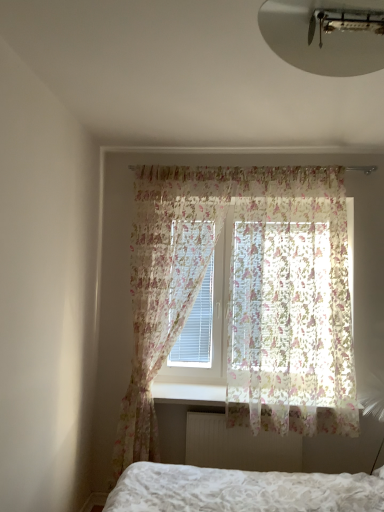
Question: Are translucent floral fabric at center, positioned as the first curtain in left-to-right order, and white matte ceiling light at upper center beside each other?

Choices:
 (A) no
 (B) yes

Answer: (A)

Question: From a real-world perspective, is translucent floral fabric at center, positioned as the first curtain in left-to-right order, below white matte ceiling light at upper center?

Choices:
 (A) yes
 (B) no

Answer: (A)

Question: From a real-world perspective, is translucent floral fabric at center, positioned as the first curtain in left-to-right order, positioned over white matte ceiling light at upper center based on gravity?

Choices:
 (A) yes
 (B) no

Answer: (B)

Question: Would you say translucent floral fabric at center, the 2th curtain in the right-to-left sequence, contains white matte ceiling light at upper center?

Choices:
 (A) yes
 (B) no

Answer: (B)

Question: Is translucent floral fabric at center, the 2th curtain in the right-to-left sequence, wider than white matte ceiling light at upper center?

Choices:
 (A) no
 (B) yes

Answer: (A)

Question: From the image's perspective, is white matte ceiling light at upper center positioned above or below white textured radiator at lower center?

Choices:
 (A) above
 (B) below

Answer: (A)

Question: From a real-world perspective, is white matte ceiling light at upper center above or below white textured radiator at lower center?

Choices:
 (A) below
 (B) above

Answer: (B)

Question: Looking at their shapes, would you say white matte ceiling light at upper center is wider or thinner than white textured radiator at lower center?

Choices:
 (A) wide
 (B) thin

Answer: (A)

Question: Considering the relative positions of white matte ceiling light at upper center and white textured radiator at lower center in the image provided, is white matte ceiling light at upper center to the left or to the right of white textured radiator at lower center?

Choices:
 (A) left
 (B) right

Answer: (A)

Question: Is translucent floral fabric at center, the 2th curtain in the right-to-left sequence, situated inside white textured radiator at lower center or outside?

Choices:
 (A) outside
 (B) inside

Answer: (A)

Question: Based on their positions, is translucent floral fabric at center, the 2th curtain in the right-to-left sequence, located to the left or right of white textured radiator at lower center?

Choices:
 (A) right
 (B) left

Answer: (B)

Question: Is translucent floral fabric at center, the 2th curtain in the right-to-left sequence, bigger or smaller than white textured radiator at lower center?

Choices:
 (A) small
 (B) big

Answer: (B)

Question: From a real-world perspective, relative to white textured radiator at lower center, is translucent floral fabric at center, the 2th curtain in the right-to-left sequence, vertically above or below?

Choices:
 (A) above
 (B) below

Answer: (A)

Question: In terms of width, does translucent floral fabric at upper center, the 1th curtain from the right, look wider or thinner when compared to white textured radiator at lower center?

Choices:
 (A) thin
 (B) wide

Answer: (B)

Question: From the image's perspective, relative to white textured radiator at lower center, is translucent floral fabric at upper center, the 1th curtain from the right, above or below?

Choices:
 (A) below
 (B) above

Answer: (B)